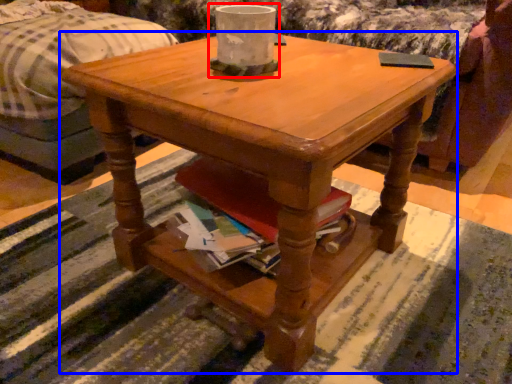
Question: Which of the following is the closest to the observer, candle holder (highlighted by a red box) or coffee table (highlighted by a blue box)?

Choices:
 (A) candle holder
 (B) coffee table

Answer: (B)